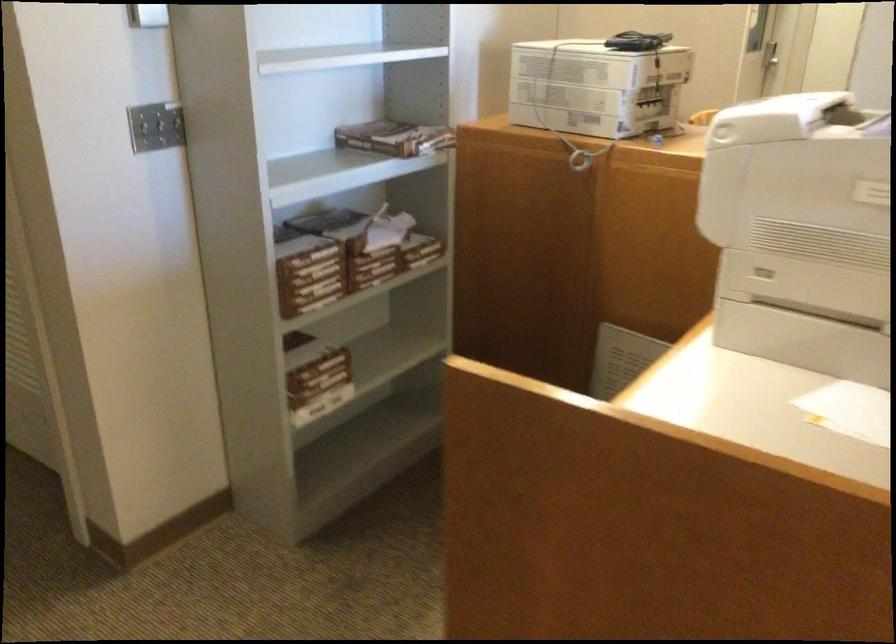
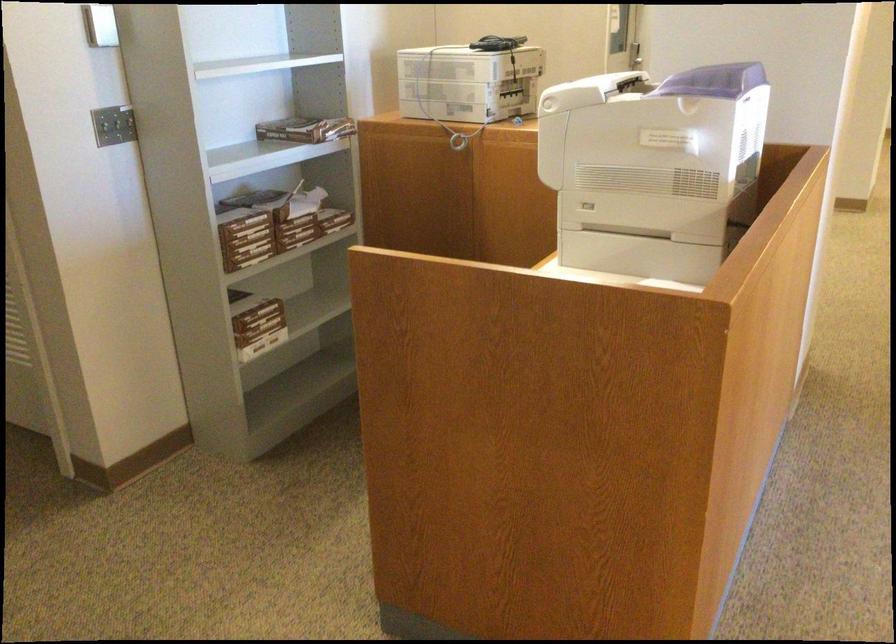
Locate, in the second image, the point that corresponds to point 375,270 in the first image.

(297, 231)